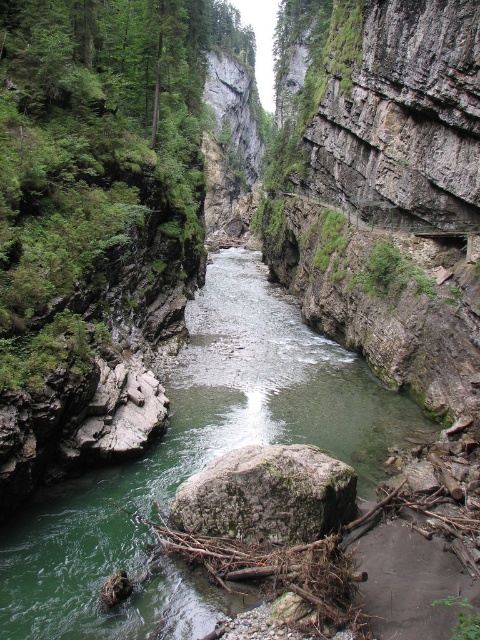
Who is higher up, green rock at center or green mossy rock at center?

Positioned higher is green rock at center.

Does green rock at center have a greater width compared to green mossy rock at center?

Yes, green rock at center is wider than green mossy rock at center.

Does point (228, 300) come behind point (338, 499)?

Yes, it is behind point (338, 499).

Locate an element on the screen. This screenshot has width=480, height=640. green rock at center is located at coordinates (194, 464).